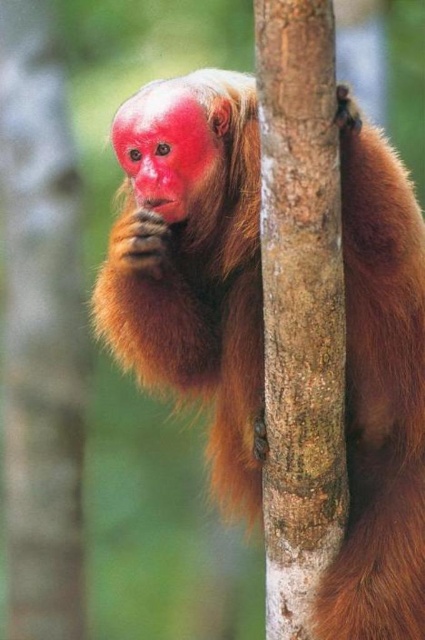
Question: Does brown rough bark at center have a larger size compared to smooth pinkish-red face at center?

Choices:
 (A) yes
 (B) no

Answer: (A)

Question: Considering the real-world distances, which object is closest to the brown rough bark at center?

Choices:
 (A) fuzzy reddish-brown monkey at center
 (B) pink matte nose at upper center
 (C) smooth brown bark at center
 (D) smooth pinkish-red face at center

Answer: (A)

Question: Can you confirm if smooth brown bark at center is wider than pink matte nose at upper center?

Choices:
 (A) no
 (B) yes

Answer: (B)

Question: Can you confirm if smooth brown bark at center is thinner than smooth pinkish-red face at center?

Choices:
 (A) yes
 (B) no

Answer: (A)

Question: Which point appears farthest from the camera in this image?

Choices:
 (A) (13, 81)
 (B) (368, 504)
 (C) (135, 170)

Answer: (A)

Question: Estimate the real-world distances between objects in this image. Which object is closer to the pink matte nose at upper center?

Choices:
 (A) fuzzy reddish-brown monkey at center
 (B) brown rough bark at center
 (C) smooth brown bark at center
 (D) smooth pinkish-red face at center

Answer: (D)